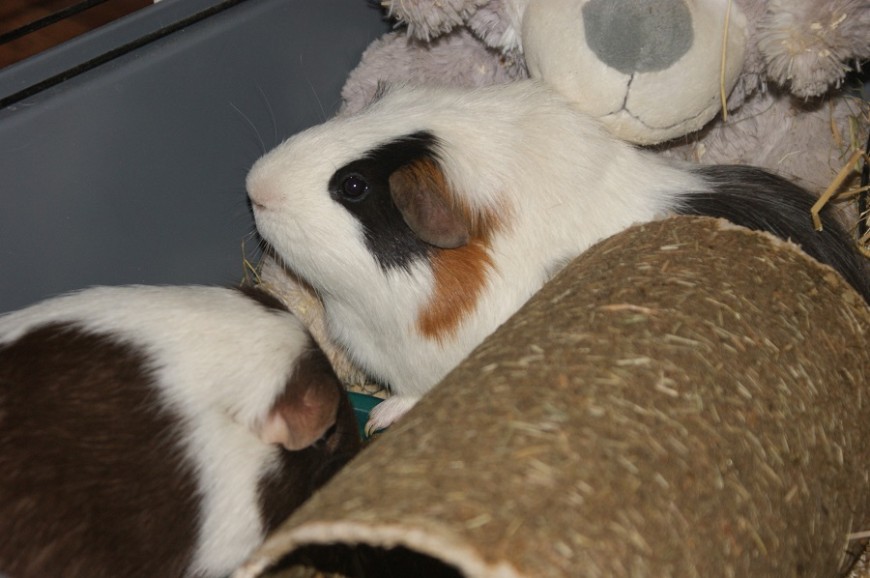
The image size is (870, 578). Identify the location of water bowl. (357, 405).